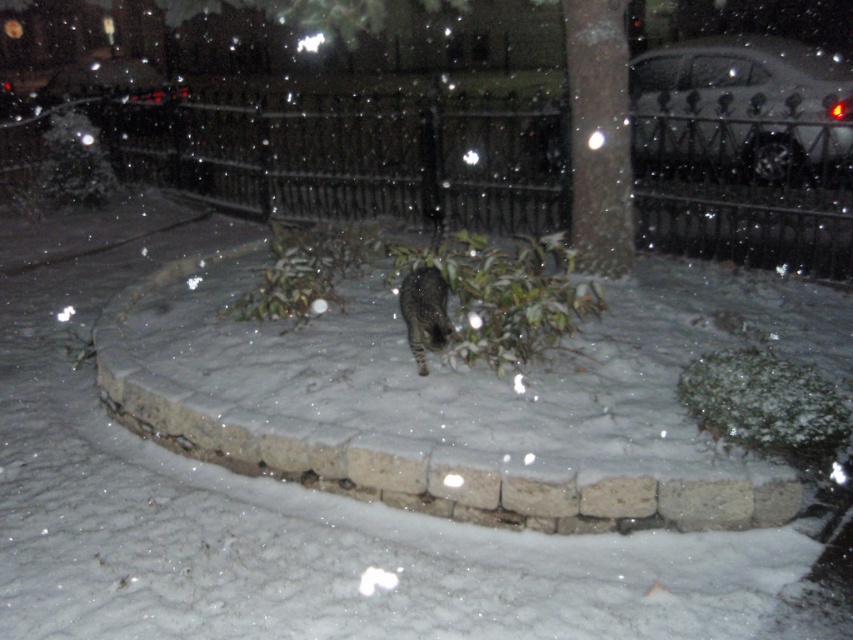
What do you see at coordinates (598, 134) in the screenshot? Image resolution: width=853 pixels, height=640 pixels. I see `dark brown bark at center` at bounding box center [598, 134].

Does dark brown bark at center appear over tabby fur cat at center?

Correct, dark brown bark at center is located above tabby fur cat at center.

Between point (618, 83) and point (418, 356), which one is positioned in front?

Positioned in front is point (418, 356).

Where is `dark brown bark at center`? The height and width of the screenshot is (640, 853). dark brown bark at center is located at coordinates (598, 134).

Does white fluffy snow at center appear under dark brown bark at center?

Yes, white fluffy snow at center is below dark brown bark at center.

Which is in front, point (602, 609) or point (598, 64)?

Point (602, 609)

Is point (70, 468) closer to viewer compared to point (599, 269)?

Yes, it is in front of point (599, 269).

Locate an element on the screen. The image size is (853, 640). white fluffy snow at center is located at coordinates (115, 465).

Is point (24, 349) farther from viewer compared to point (399, 301)?

Yes, it is.

Who is positioned more to the left, white fluffy snow at center or tabby fur cat at center?

From the viewer's perspective, white fluffy snow at center appears more on the left side.

Identify the location of white fluffy snow at center. (115, 465).